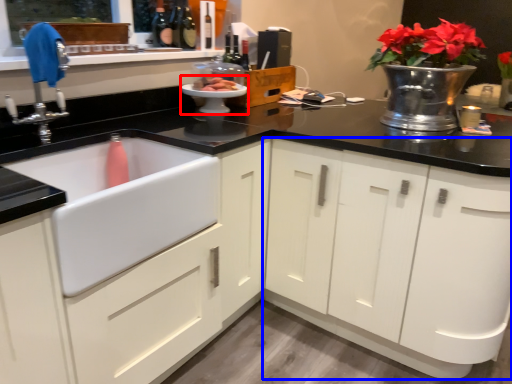
Question: Which of the following is the farthest to the observer, appliance (highlighted by a red box) or cabinetry (highlighted by a blue box)?

Choices:
 (A) appliance
 (B) cabinetry

Answer: (A)